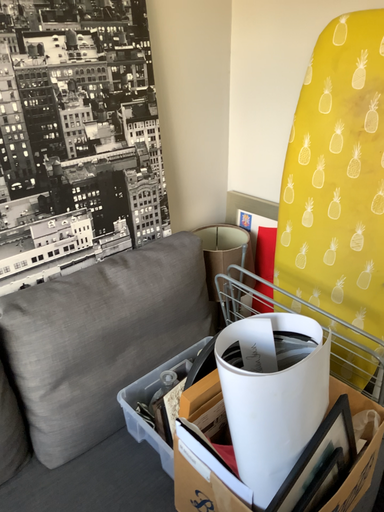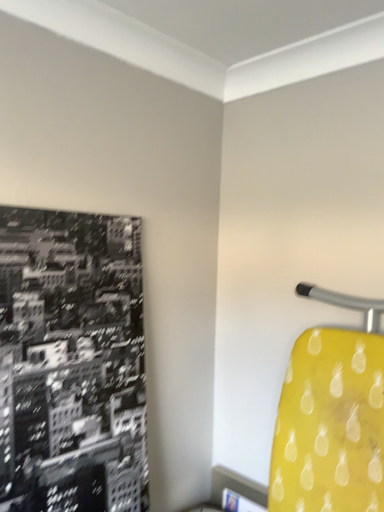
Question: How did the camera likely rotate when shooting the video?

Choices:
 (A) rotated upward
 (B) rotated downward

Answer: (A)